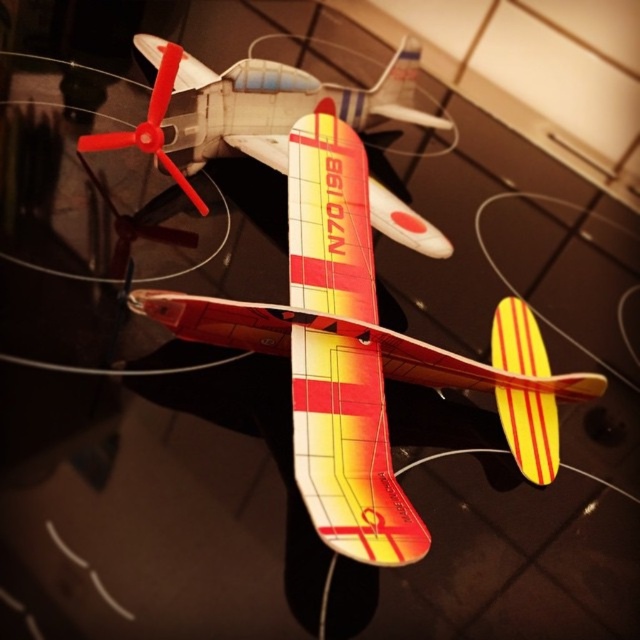
Question: Is shiny red airplane at center above red plastic propeller at center?

Choices:
 (A) yes
 (B) no

Answer: (A)

Question: Among these objects, which one is nearest to the camera?

Choices:
 (A) red plastic propeller at center
 (B) shiny red airplane at center
 (C) matte plastic airplane at center

Answer: (C)

Question: Is shiny red airplane at center to the right of red plastic propeller at center from the viewer's perspective?

Choices:
 (A) no
 (B) yes

Answer: (B)

Question: Is matte plastic airplane at center below shiny red airplane at center?

Choices:
 (A) yes
 (B) no

Answer: (A)

Question: Which of these objects is positioned farthest from the shiny red airplane at center?

Choices:
 (A) matte plastic airplane at center
 (B) red plastic propeller at center

Answer: (A)

Question: Which point is closer to the camera taking this photo?

Choices:
 (A) (156, 147)
 (B) (300, 93)

Answer: (A)